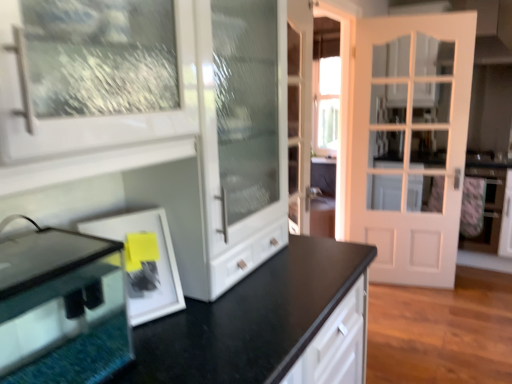
Question: Considering the relative positions of clear glass fish tank at lower left and white matte picture frame at lower left in the image provided, is clear glass fish tank at lower left to the left or to the right of white matte picture frame at lower left?

Choices:
 (A) left
 (B) right

Answer: (A)

Question: Is clear glass fish tank at lower left in front of or behind white matte picture frame at lower left in the image?

Choices:
 (A) front
 (B) behind

Answer: (A)

Question: Which object is the farthest from the white matte door at right?

Choices:
 (A) clear glass fish tank at lower left
 (B) white matte picture frame at lower left

Answer: (A)

Question: Which object is positioned farthest from the clear glass fish tank at lower left?

Choices:
 (A) white matte door at right
 (B) white matte picture frame at lower left

Answer: (A)